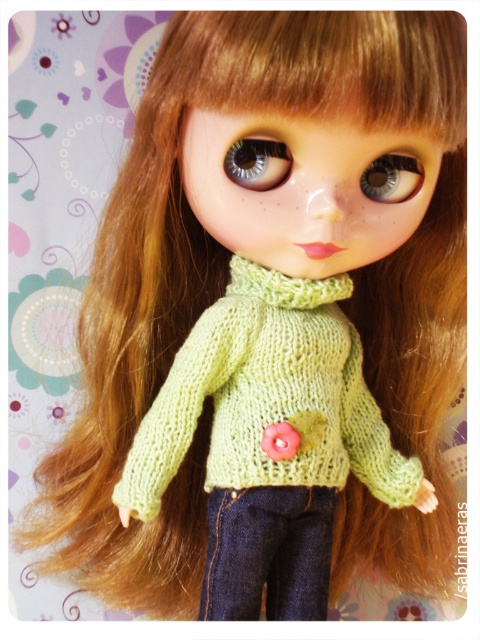
Who is taller, denim jeans at lower center or shiny gray eye at center?

denim jeans at lower center is taller.

Is denim jeans at lower center thinner than shiny gray eye at center?

In fact, denim jeans at lower center might be wider than shiny gray eye at center.

Is point (319, 618) closer to camera compared to point (373, 188)?

That is False.

Where is `denim jeans at lower center`? The image size is (480, 640). denim jeans at lower center is located at coordinates (267, 552).

Between denim jeans at lower center and shiny silver eye at center, which one appears on the right side from the viewer's perspective?

denim jeans at lower center

This screenshot has width=480, height=640. Describe the element at coordinates (267, 552) in the screenshot. I see `denim jeans at lower center` at that location.

Identify the location of denim jeans at lower center. This screenshot has width=480, height=640. (267, 552).

Between green knitted scarf at center and shiny gray eye at center, which one is positioned lower?

Positioned lower is green knitted scarf at center.

Does green knitted scarf at center appear over shiny gray eye at center?

Incorrect, green knitted scarf at center is not positioned above shiny gray eye at center.

The height and width of the screenshot is (640, 480). Describe the element at coordinates (285, 285) in the screenshot. I see `green knitted scarf at center` at that location.

The height and width of the screenshot is (640, 480). I want to click on green knitted scarf at center, so click(x=285, y=285).